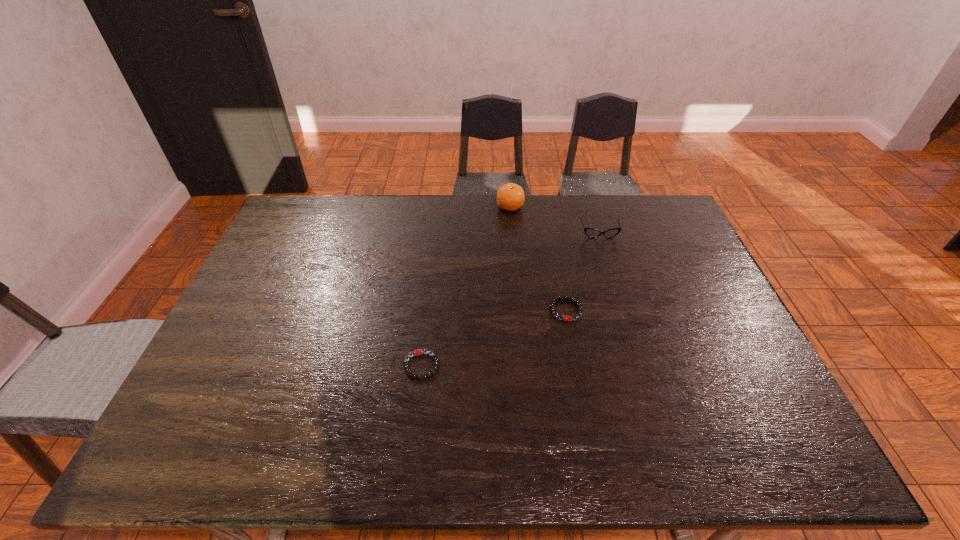
Find the location of a particular element. The height and width of the screenshot is (540, 960). the tallest object is located at coordinates tap(510, 197).

You are a GUI agent. You are given a task and a screenshot of the screen. Output one action in this format:
    pyautogui.click(x=<x>, y=<y>)
    Task: Click on the clementine
    
    Given the screenshot: What is the action you would take?
    pyautogui.click(x=510, y=197)

You are a GUI agent. You are given a task and a screenshot of the screen. Output one action in this format:
    pyautogui.click(x=<x>, y=<y>)
    Task: Click on the rightmost object
    This screenshot has width=960, height=540.
    Given the screenshot: What is the action you would take?
    pyautogui.click(x=590, y=232)

What are the coordinates of `spectacles` in the screenshot? It's located at (590, 232).

Image resolution: width=960 pixels, height=540 pixels. In order to click on the second object from right to left in this screenshot , I will do `click(566, 318)`.

You are a GUI agent. You are given a task and a screenshot of the screen. Output one action in this format:
    pyautogui.click(x=<x>, y=<y>)
    Task: Click on the right bracelet
    The width and height of the screenshot is (960, 540).
    Given the screenshot: What is the action you would take?
    pyautogui.click(x=566, y=318)

You are a GUI agent. You are given a task and a screenshot of the screen. Output one action in this format:
    pyautogui.click(x=<x>, y=<y>)
    Task: Click on the nearer bracelet
    Image resolution: width=960 pixels, height=540 pixels.
    Given the screenshot: What is the action you would take?
    pyautogui.click(x=417, y=352)

At what (x,y) coordinates should I click in order to perform the action: click on the nearest object. Please return your answer as a coordinate pair (x, y). Looking at the image, I should click on (417, 352).

Where is `vacant position located on the front of the clementine`? The image size is (960, 540). vacant position located on the front of the clementine is located at coordinates (514, 246).

At what (x,y) coordinates should I click in order to perform the action: click on vacant point located on the front-facing side of the second farthest object. Please return your answer as a coordinate pair (x, y). This screenshot has height=540, width=960. Looking at the image, I should click on (610, 268).